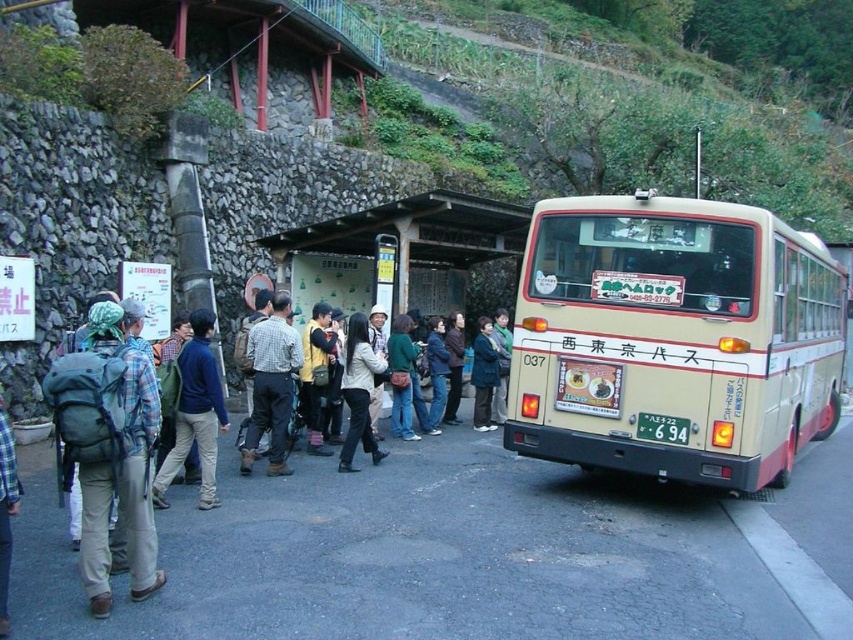
Consider the image. Can you confirm if blue sweater at center is smaller than dark blue fabric jacket at center?

Actually, blue sweater at center might be larger than dark blue fabric jacket at center.

Which is in front, point (202, 380) or point (490, 358)?

Point (202, 380) is in front.

Find the location of a particular element. blue sweater at center is located at coordinates (195, 413).

Is point (166, 468) closer to camera compared to point (653, 424)?

Yes, it is.

How much distance is there between blue sweater at center and white plastic license plate at center?

blue sweater at center and white plastic license plate at center are 4.34 meters apart from each other.

Locate an element on the screen. The height and width of the screenshot is (640, 853). blue sweater at center is located at coordinates (195, 413).

This screenshot has width=853, height=640. What are the coordinates of `blue sweater at center` in the screenshot? It's located at (195, 413).

Does beige matte bus at right appear on the right side of checkered fabric shirt at center?

Correct, you'll find beige matte bus at right to the right of checkered fabric shirt at center.

I want to click on beige matte bus at right, so pos(674,337).

Is point (784, 236) positioned behind point (283, 356)?

That is False.

Locate an element on the screen. beige matte bus at right is located at coordinates (674, 337).